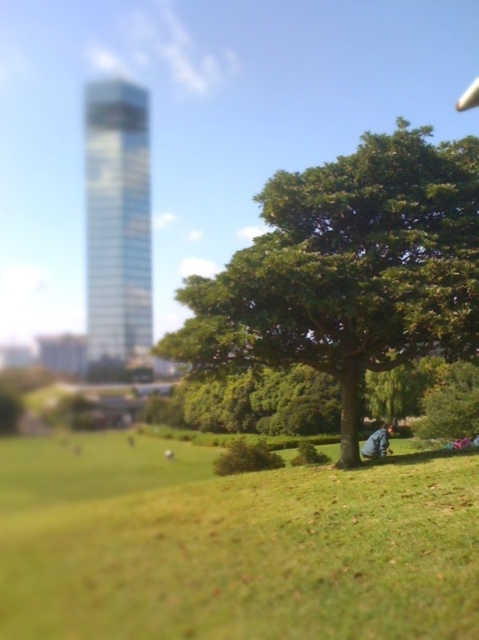
Question: Is green leafy tree at center bigger than blue denim jeans at lower right?

Choices:
 (A) no
 (B) yes

Answer: (A)

Question: Which point appears closest to the camera in this image?

Choices:
 (A) (372, 436)
 (B) (228, 317)
 (C) (409, 614)

Answer: (C)

Question: Estimate the real-world distances between objects in this image. Which object is farther from the blue denim jeans at lower right?

Choices:
 (A) green leafy tree at center
 (B) green grassy field at lower center

Answer: (B)

Question: Is green leafy tree at center smaller than blue denim jeans at lower right?

Choices:
 (A) yes
 (B) no

Answer: (A)

Question: Does green grassy field at lower center appear on the right side of blue denim jeans at lower right?

Choices:
 (A) no
 (B) yes

Answer: (A)

Question: Which point is farther from the camera taking this photo?

Choices:
 (A) (377, 195)
 (B) (387, 433)

Answer: (B)